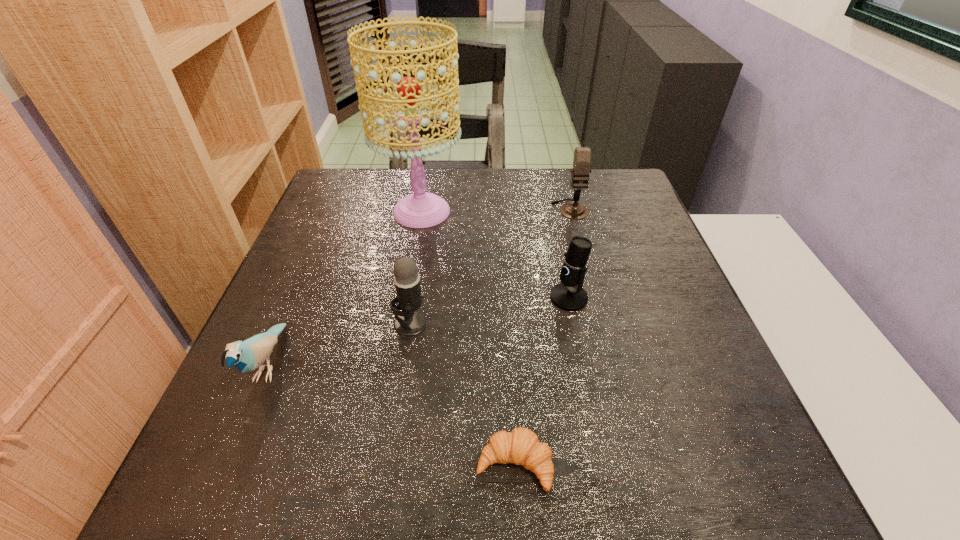
Identify the location of free space at the far left corner of the desktop. (332, 180).

The image size is (960, 540). I want to click on free location at the far right corner, so click(619, 174).

What are the coordinates of `free space between the nearest object and the leftmost object` in the screenshot? It's located at (392, 415).

Where is `free spot between the leftmost microphone and the crescent roll`? free spot between the leftmost microphone and the crescent roll is located at coordinates (463, 394).

Locate an element on the screen. The width and height of the screenshot is (960, 540). free space between the shortest object and the leftmost microphone is located at coordinates (463, 394).

Where is `free space between the nearest object and the leftmost microphone`? The height and width of the screenshot is (540, 960). free space between the nearest object and the leftmost microphone is located at coordinates (463, 394).

The width and height of the screenshot is (960, 540). I want to click on blank region between the tallest object and the leftmost object, so click(x=346, y=288).

Identify the location of object that is the fourth closest one to the tallest object. (247, 355).

In order to click on object that can be found as the fourth closest to the bird in this screenshot , I will do `click(569, 295)`.

The width and height of the screenshot is (960, 540). I want to click on the third closest microphone to the nearest object, so click(582, 155).